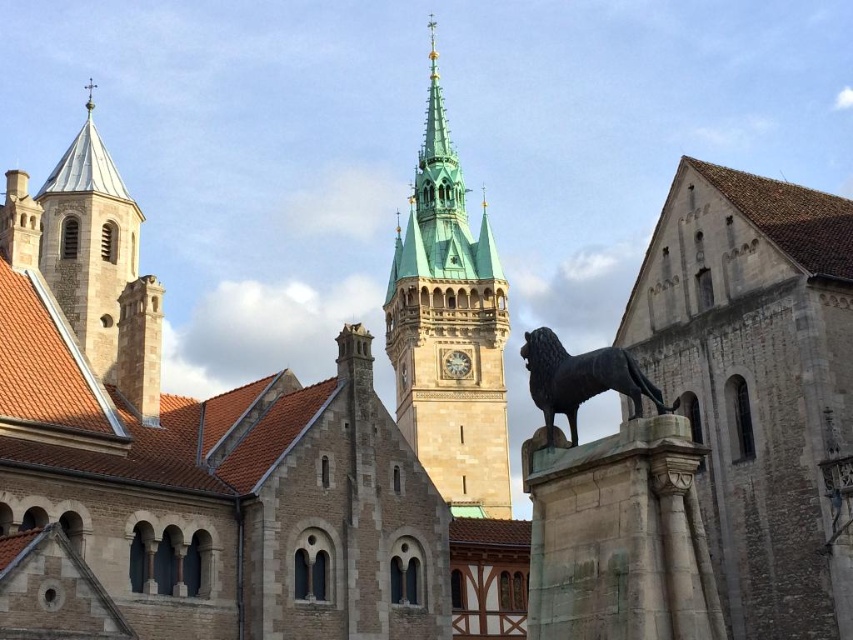
Can you confirm if green stone clock tower at center is positioned below bronze statue at center?

Actually, green stone clock tower at center is above bronze statue at center.

Between green stone clock tower at center and bronze statue at center, which one has less height?

bronze statue at center

Locate an element on the screen. green stone clock tower at center is located at coordinates (450, 328).

Between point (99, 328) and point (450, 356), which one is positioned in front?

Point (99, 328) is more forward.

From the picture: Is smooth stone tower at upper left behind metallic clock at center?

No, it is not.

What do you see at coordinates (91, 264) in the screenshot? I see `smooth stone tower at upper left` at bounding box center [91, 264].

You are a GUI agent. You are given a task and a screenshot of the screen. Output one action in this format:
    pyautogui.click(x=<x>, y=<y>)
    Task: Click on the smooth stone tower at upper left
    This screenshot has width=853, height=640.
    Given the screenshot: What is the action you would take?
    click(91, 264)

Is point (422, 189) behind point (450, 365)?

Yes, point (422, 189) is farther from viewer.

Locate an element on the screen. The height and width of the screenshot is (640, 853). green stone clock tower at center is located at coordinates (450, 328).

Image resolution: width=853 pixels, height=640 pixels. I want to click on green stone clock tower at center, so click(450, 328).